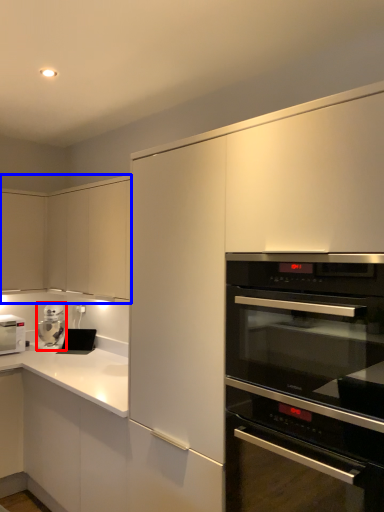
Question: Among these objects, which one is farthest to the camera, kitchen appliance (highlighted by a red box) or cabinetry (highlighted by a blue box)?

Choices:
 (A) kitchen appliance
 (B) cabinetry

Answer: (A)